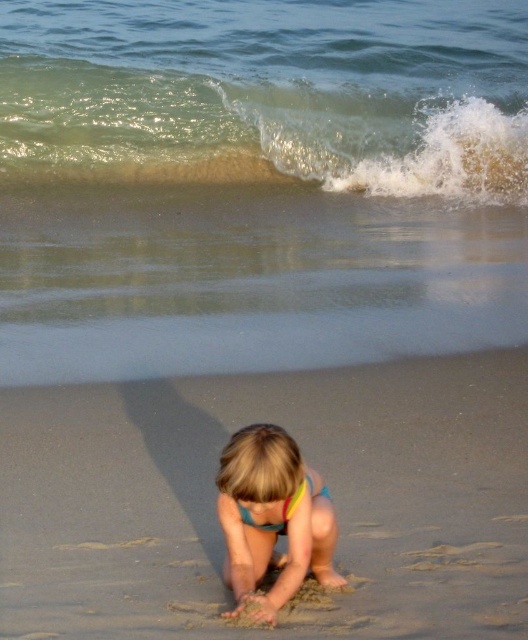
Question: Estimate the real-world distances between objects in this image. Which object is closer to the fine-grained sand at lower center?

Choices:
 (A) multicolored swimsuit at center
 (B) translucent green water at upper center

Answer: (A)

Question: Is greenish sand at upper center below multicolored swimsuit at center?

Choices:
 (A) yes
 (B) no

Answer: (B)

Question: Is the position of fine-grained sand at lower center less distant than that of translucent green water at upper center?

Choices:
 (A) yes
 (B) no

Answer: (A)

Question: Which of the following is the closest to the observer?

Choices:
 (A) translucent green water at upper center
 (B) greenish sand at upper center

Answer: (B)

Question: Is fine-grained sand at lower center thinner than multicolored swimsuit at center?

Choices:
 (A) no
 (B) yes

Answer: (A)

Question: Which of the following is the farthest from the observer?

Choices:
 (A) greenish sand at upper center
 (B) translucent green water at upper center
 (C) fine-grained sand at lower center

Answer: (B)